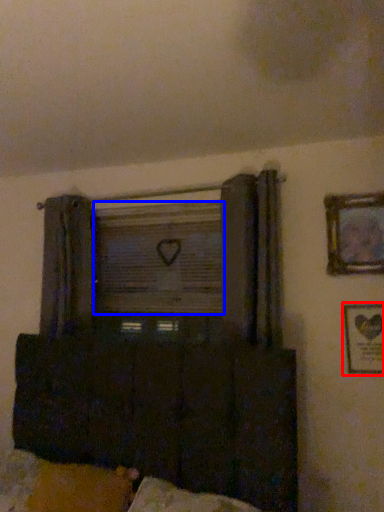
Question: Which point is closer to the camera, picture frame (highlighted by a red box) or window screen (highlighted by a blue box)?

Choices:
 (A) picture frame
 (B) window screen

Answer: (A)